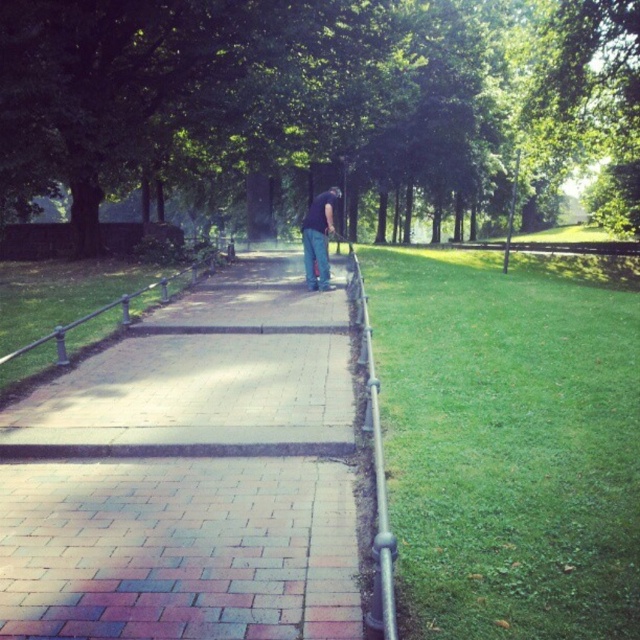
Question: Can you confirm if brick paved walkway at center is wider than silver metallic rail at center?

Choices:
 (A) no
 (B) yes

Answer: (A)

Question: Which point appears closest to the camera in this image?

Choices:
 (A) (378, 408)
 (B) (170, 160)

Answer: (A)

Question: Among these points, which one is nearest to the camera?

Choices:
 (A) (636, 406)
 (B) (216, 548)

Answer: (B)

Question: Does green leafy tree at center come behind brick paved walkway at center?

Choices:
 (A) no
 (B) yes

Answer: (B)

Question: Which of the following is the closest to the observer?

Choices:
 (A) (417, 99)
 (B) (83, 305)
 (C) (320, 412)
 (D) (364, 348)

Answer: (C)

Question: Can you confirm if green leafy tree at center is wider than brick paved walkway at center?

Choices:
 (A) yes
 (B) no

Answer: (A)